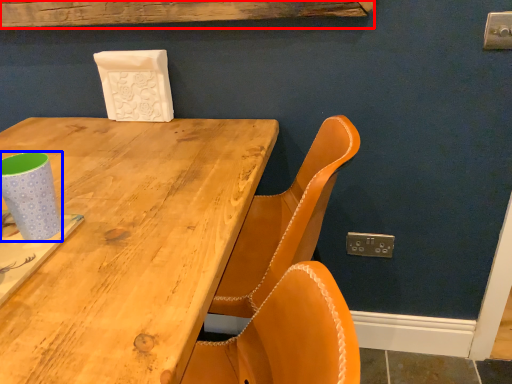
Question: Among these objects, which one is nearest to the camera, plank (highlighted by a red box) or paper cup (highlighted by a blue box)?

Choices:
 (A) plank
 (B) paper cup

Answer: (B)